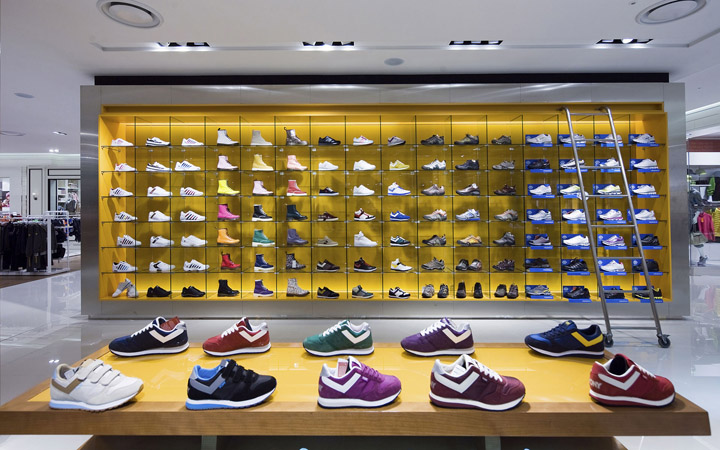
This screenshot has height=450, width=720. In order to click on sneakers on the table in this screenshot , I will do (x=630, y=376), (x=572, y=339), (x=482, y=393), (x=446, y=340), (x=364, y=333), (x=369, y=399), (x=215, y=401), (x=234, y=337), (x=157, y=341), (x=101, y=393).